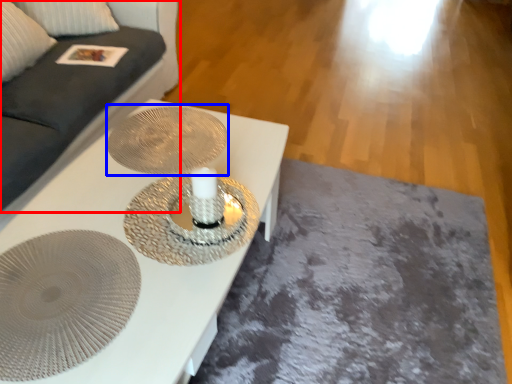
Question: Which of the following is the farthest to the observer, couch (highlighted by a red box) or oval (highlighted by a blue box)?

Choices:
 (A) couch
 (B) oval

Answer: (B)